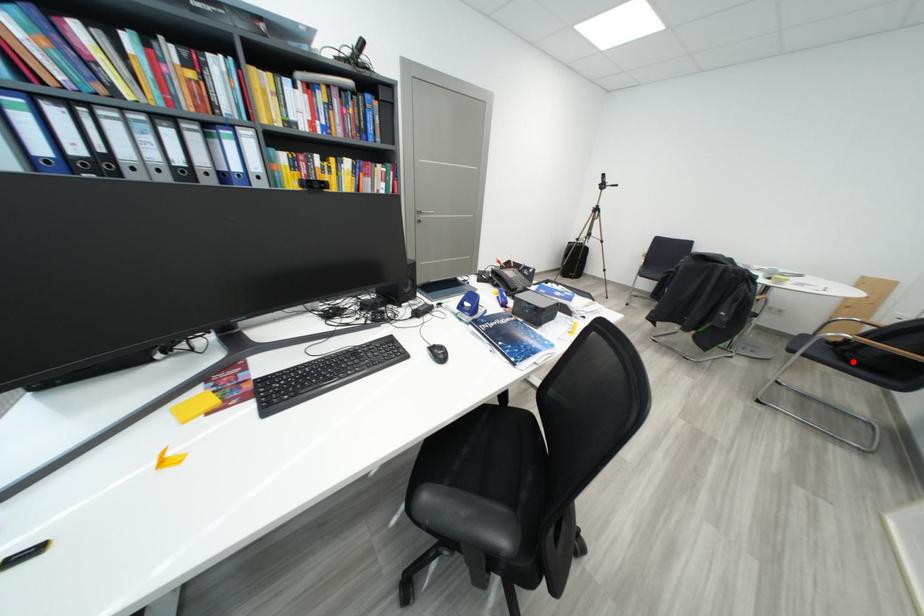
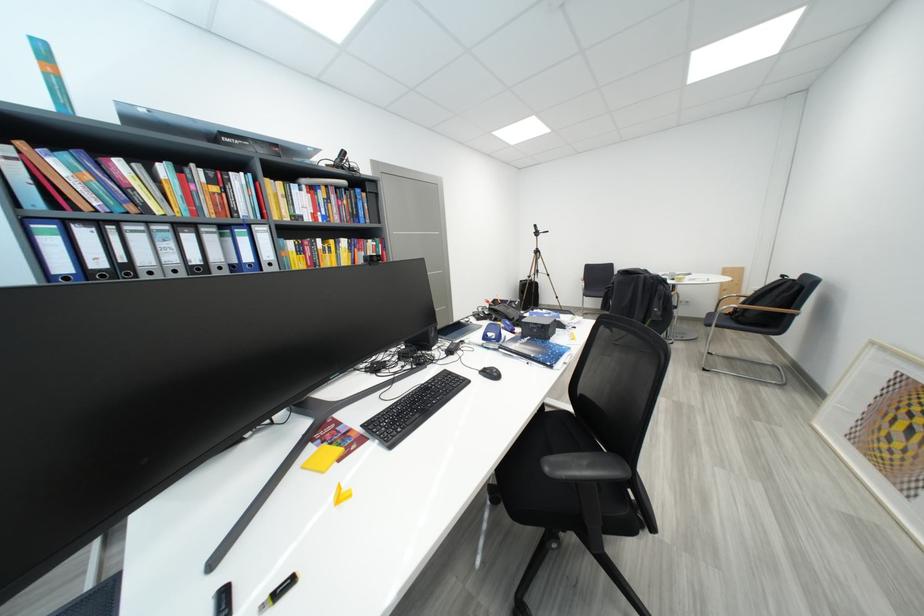
Question: I am providing you with two images of the same scene from different viewpoints. A red point is shown in image1. For the corresponding object point in image2, is it positioned nearer or farther from the camera?

Choices:
 (A) Nearer
 (B) Farther

Answer: (A)